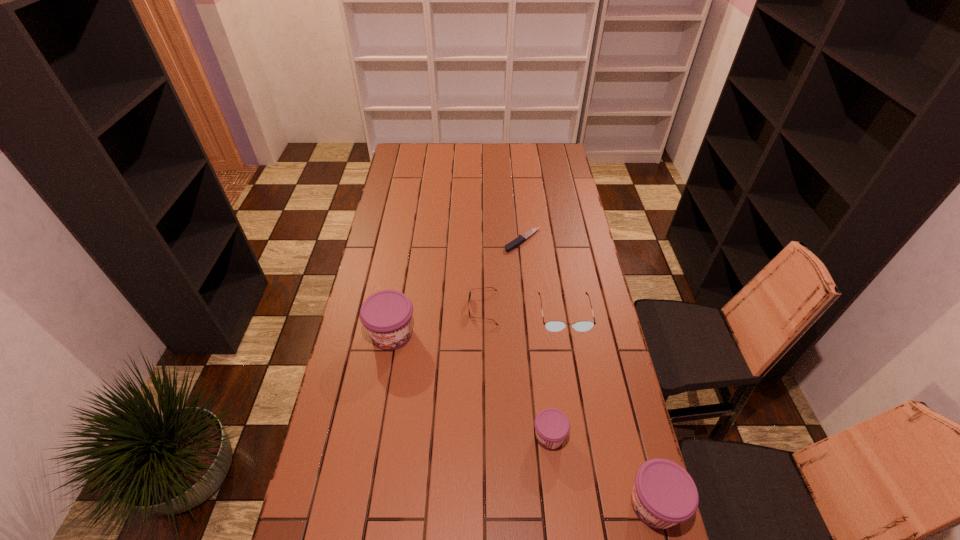
At what (x,y) coordinates should I click in order to perform the action: click on sunglasses. Please return your answer as a coordinate pair (x, y). Looking at the image, I should click on (486, 287).

Locate an element on the screen. The image size is (960, 540). free region located 0.300m on the front label of the farthest jam is located at coordinates (373, 443).

What are the coordinates of `vacant space located on the front label of the second nearest jam` in the screenshot? It's located at (395, 436).

I want to click on vacant space located 0.220m on the front label of the second nearest jam, so click(x=456, y=436).

Identify the location of vacant space located on the front label of the second nearest jam. (470, 436).

The image size is (960, 540). Find the location of `vacant space situated on the front label of the nearest jam`. vacant space situated on the front label of the nearest jam is located at coordinates (522, 504).

I want to click on vacant space located 0.140m on the front label of the nearest jam, so click(x=572, y=504).

Locate an element on the screen. free spot located 0.300m on the front label of the nearest jam is located at coordinates (511, 504).

What are the coordinates of `free space located 0.400m on the lenses of the spectacles` in the screenshot? It's located at (588, 445).

You are a GUI agent. You are given a task and a screenshot of the screen. Output one action in this format:
    pyautogui.click(x=<x>, y=<y>)
    Task: Click on the vacant space located on the right of the farthest object
    This screenshot has width=960, height=540.
    Given the screenshot: What is the action you would take?
    pyautogui.click(x=563, y=240)